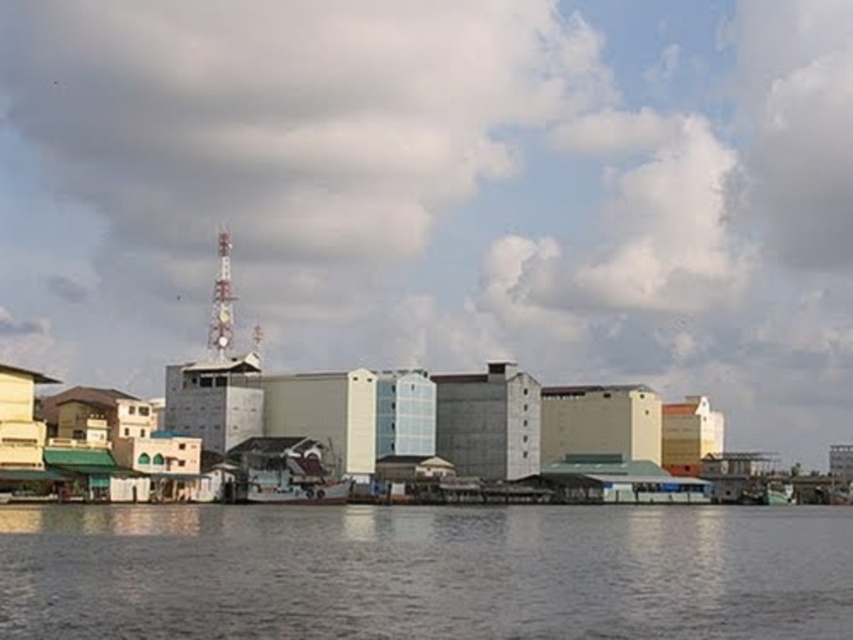
Is white fluffy cloud at upper center closer to the viewer compared to transparent water at lower center?

That is False.

This screenshot has width=853, height=640. What do you see at coordinates (442, 192) in the screenshot?
I see `white fluffy cloud at upper center` at bounding box center [442, 192].

Where is `white fluffy cloud at upper center`? white fluffy cloud at upper center is located at coordinates (442, 192).

Who is taller, transparent water at lower center or white matte boat at center?

transparent water at lower center

Can you confirm if transparent water at lower center is thinner than white matte boat at center?

Incorrect, transparent water at lower center's width is not less than white matte boat at center's.

Which is behind, point (347, 628) or point (291, 502)?

Point (291, 502)

Where is `transparent water at lower center`? transparent water at lower center is located at coordinates (425, 572).

Between point (776, 444) and point (306, 484), which one is positioned behind?

The point (776, 444) is behind.

Between white fluffy cloud at upper center and white matte boat at center, which one is positioned higher?

Positioned higher is white fluffy cloud at upper center.

Does point (521, 67) lie in front of point (328, 490)?

No, it is not.

This screenshot has width=853, height=640. Identify the location of white fluffy cloud at upper center. (442, 192).